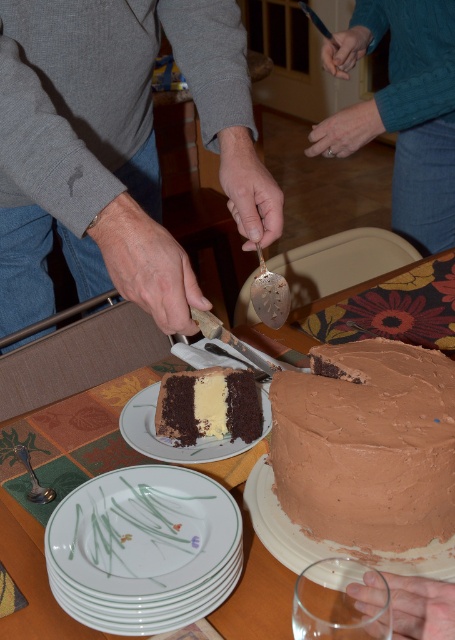
Who is lower down, chocolate matte cake at center or brown matte cake at center?

chocolate matte cake at center

Who is positioned more to the right, chocolate matte cake at center or brown matte cake at center?

chocolate matte cake at center

The image size is (455, 640). Identify the location of chocolate matte cake at center. (367, 444).

In order to click on chocolate matte cake at center in this screenshot , I will do `click(367, 444)`.

Looking at this image, which is below, blue knitted sweater at upper right or wooden handle knife at center?

Positioned lower is wooden handle knife at center.

Can you confirm if blue knitted sweater at upper right is thinner than wooden handle knife at center?

No, blue knitted sweater at upper right is not thinner than wooden handle knife at center.

Does point (423, 232) lie in front of point (242, 342)?

No, it is not.

The width and height of the screenshot is (455, 640). Find the location of `blue knitted sweater at upper right`. blue knitted sweater at upper right is located at coordinates (404, 109).

How distant is gray cotton sweater at upper left from blue knitted sweater at upper right?

gray cotton sweater at upper left is 50.81 centimeters away from blue knitted sweater at upper right.

Can you confirm if gray cotton sweater at upper left is thinner than blue knitted sweater at upper right?

In fact, gray cotton sweater at upper left might be wider than blue knitted sweater at upper right.

This screenshot has height=640, width=455. In order to click on gray cotton sweater at upper left in this screenshot , I will do `click(115, 148)`.